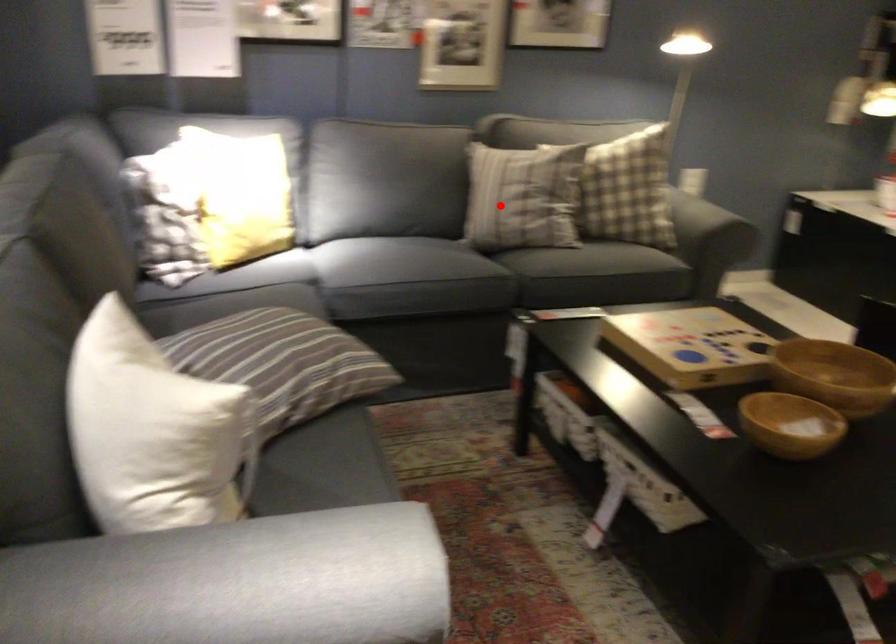
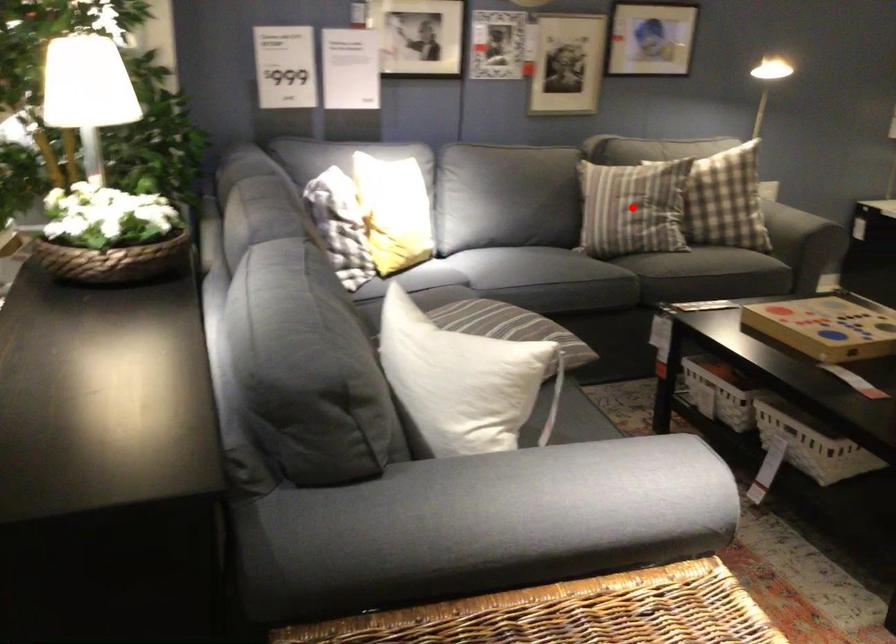
I am providing you with two images of the same scene from different viewpoints. A red point is marked on the first image and another point is marked on the second image. Is the red point in image1 aligned with the point shown in image2?

Yes